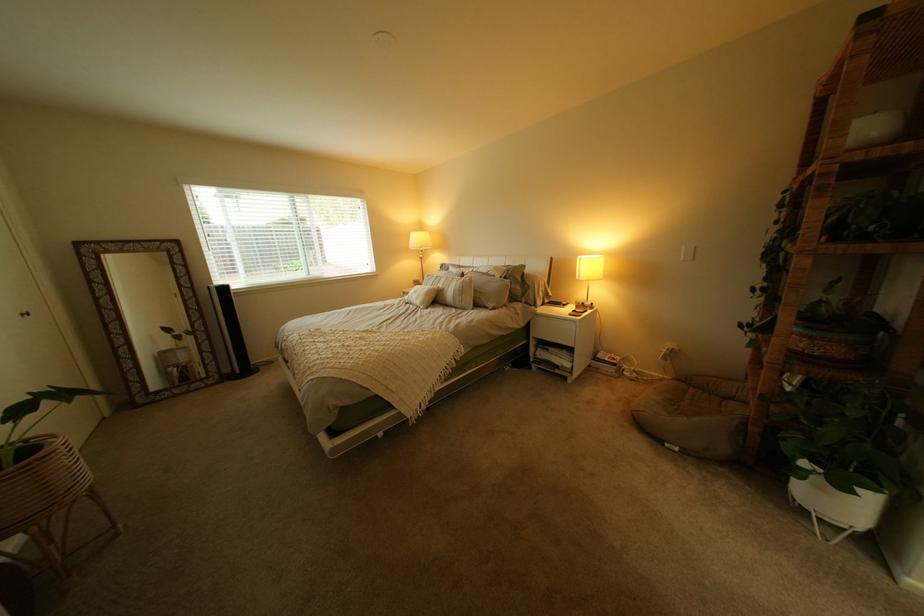
The height and width of the screenshot is (616, 924). In order to click on lamp base switch in this screenshot , I will do `click(687, 253)`.